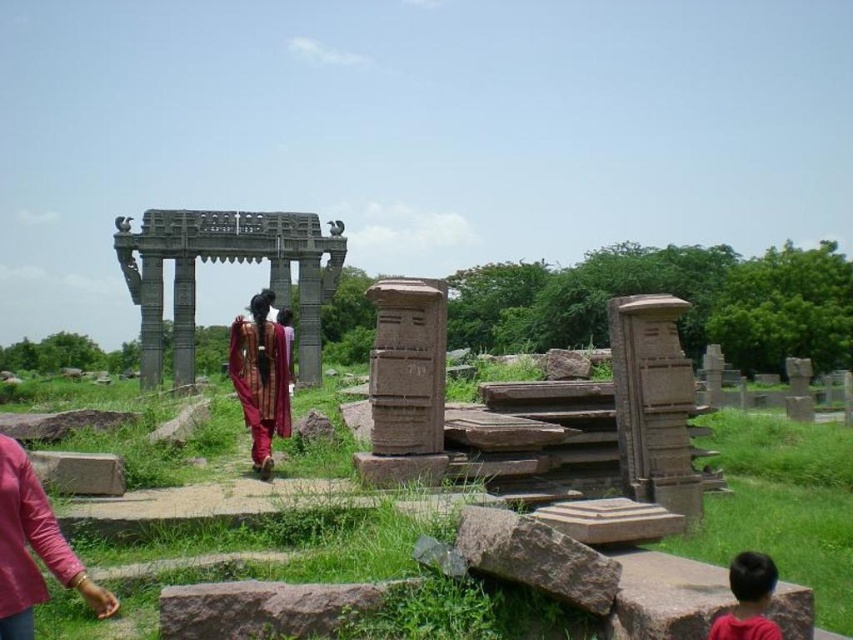
Question: Estimate the real-world distances between objects in this image. Which object is closer to the matte red robe at lower left?

Choices:
 (A) dark brown hair at lower right
 (B) maroon silk robe at center
 (C) green grass at center

Answer: (C)

Question: Is matte red robe at lower left above maroon silk robe at center?

Choices:
 (A) no
 (B) yes

Answer: (A)

Question: Based on their relative distances, which object is nearer to the dark brown hair at lower right?

Choices:
 (A) green grass at center
 (B) matte red robe at lower left

Answer: (A)

Question: Does green grass at center have a larger size compared to matte red robe at lower left?

Choices:
 (A) yes
 (B) no

Answer: (A)

Question: Is matte red robe at lower left wider than maroon silk robe at center?

Choices:
 (A) yes
 (B) no

Answer: (A)

Question: Which point is farther to the camera?

Choices:
 (A) green grass at center
 (B) matte red robe at lower left
 (C) dark brown hair at lower right
 (D) maroon silk robe at center

Answer: (D)